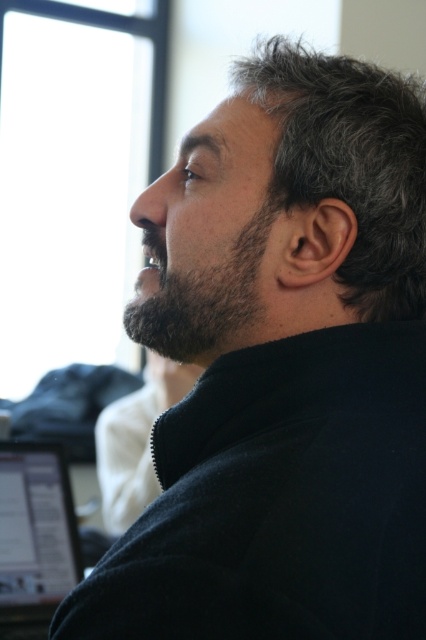
You are a photographer setting up a shoot in this scene. You need to place a small tripod between the black glossy laptop at lower left and the dark brown fuzzy beard at center so that it doesn t block either object. Given that the tripod requires 15 cm of vertical space to fit, can you determine if there s enough space between them?

The black glossy laptop at lower left has a greater height compared to the dark brown fuzzy beard at center. Since the laptop is taller, the vertical space between them is sufficient to accommodate the tripod requiring 15 cm of vertical space.

You are an office assistant who needs to place a new document on the desk. The document must be placed above the dark brown fuzzy beard at center but not overlapping with the black glossy laptop at lower left. Is there enough space on the desk for this?

The black glossy laptop at lower left is located below the dark brown fuzzy beard at center, so there is space above the dark brown fuzzy beard at center where the document can be placed without overlapping the laptop.